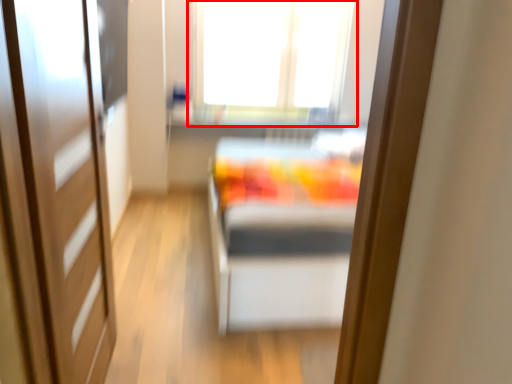
Question: In this image, where is window (annotated by the red box) located relative to door?

Choices:
 (A) right
 (B) left

Answer: (A)